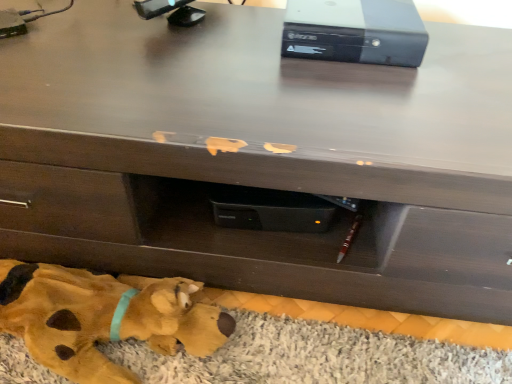
What are the coordinates of `empty space that is ontop of black plastic computer at upper center (from a real-world perspective)` in the screenshot? It's located at (361, 11).